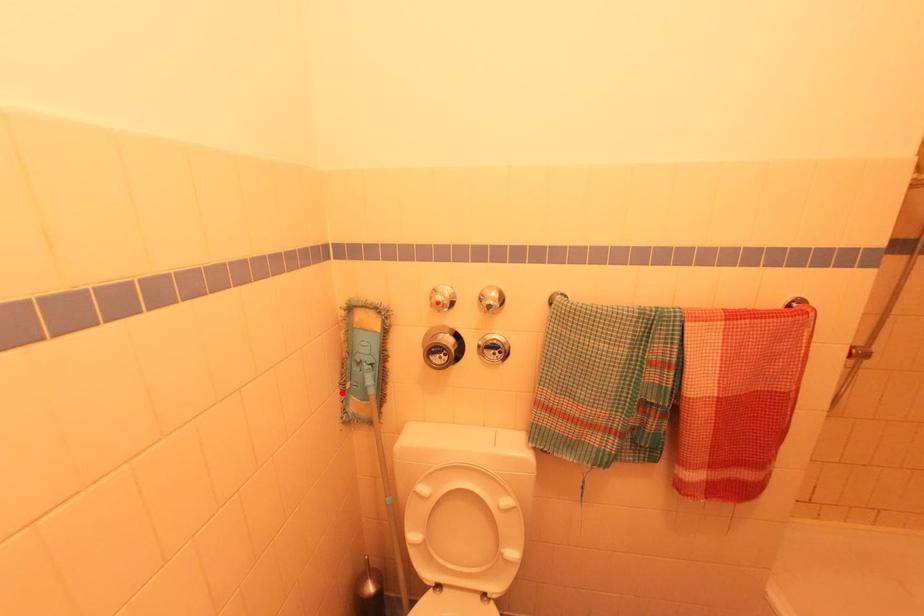
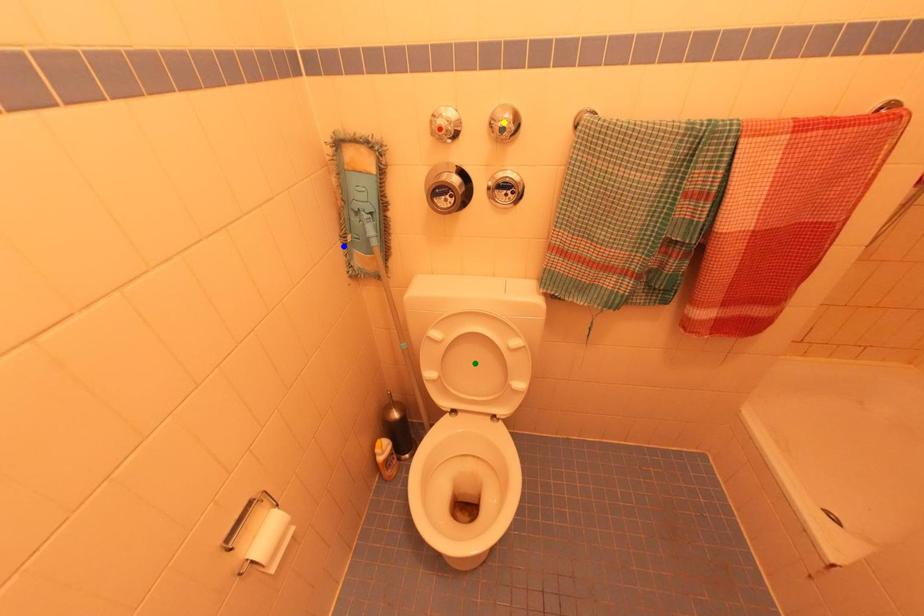
Question: I am providing you with two images of the same scene from different viewpoints. A red point is marked on the first image. You are given multiple points on the second image. Can you choose the point in image 2 that corresponds to the point in image 1?

Choices:
 (A) green point
 (B) yellow point
 (C) blue point

Answer: (C)